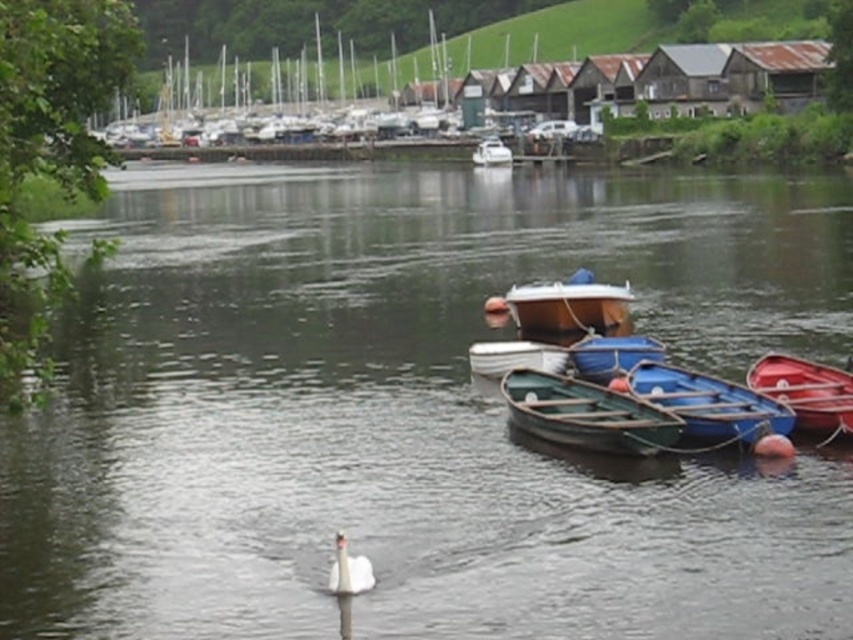
Between blue wood canoe at right and white glossy boat at center, which one has less height?

blue wood canoe at right

Can you confirm if blue wood canoe at right is wider than white glossy boat at center?

In fact, blue wood canoe at right might be narrower than white glossy boat at center.

Is point (717, 445) closer to camera compared to point (474, 160)?

Yes, point (717, 445) is in front of point (474, 160).

Identify the location of blue wood canoe at right. (711, 404).

Does point (529, 428) come behind point (476, 161)?

No, (529, 428) is in front of (476, 161).

Identify the location of green wooden canoe at center. The height and width of the screenshot is (640, 853). (585, 413).

I want to click on green wooden canoe at center, so click(x=585, y=413).

Between green wooden canoe at center and white glossy swan at lower center, which one has less height?

With less height is white glossy swan at lower center.

Who is lower down, green wooden canoe at center or white glossy swan at lower center?

white glossy swan at lower center is below.

Does point (592, 406) come closer to viewer compared to point (341, 589)?

No, (592, 406) is further to viewer.

Locate an element on the screen. This screenshot has width=853, height=640. green wooden canoe at center is located at coordinates click(x=585, y=413).